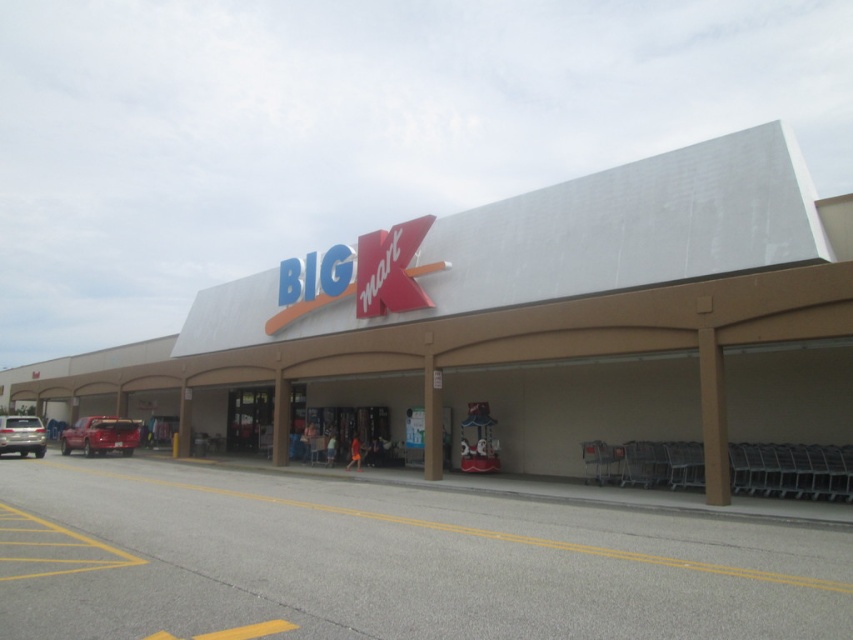
You are standing at the entrance of the Kmart store and want to take a photo of both the white concrete mall at center and the shiny red truck at lower left. Can you position yourself so that both objects are visible in the same frame without moving either object?

The white concrete mall at center is located above the shiny red truck at lower left, so you can position yourself in a way that captures both objects in the same frame by angling the camera upwards to include the mall above and the truck below.